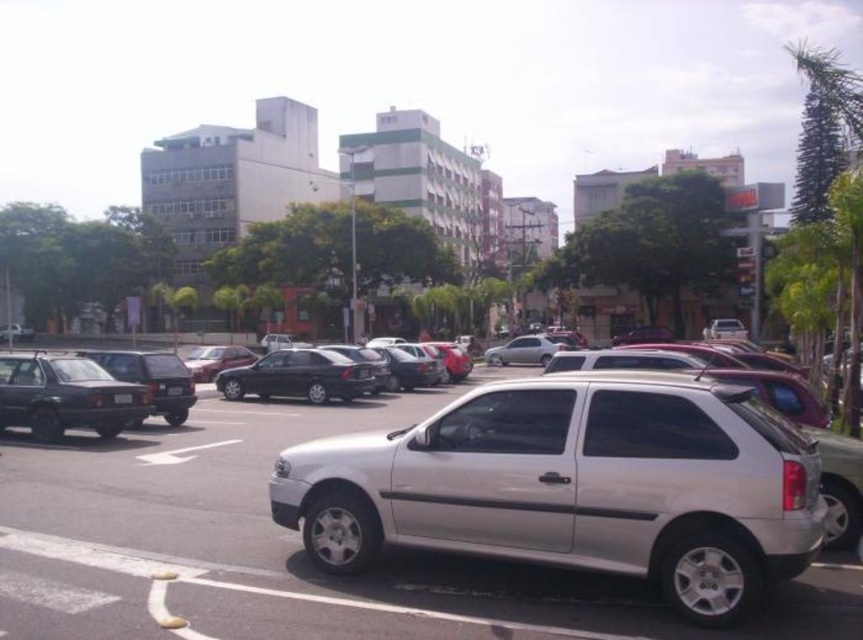
Is satin black sedan at center to the left of satin silver sedan at center from the viewer's perspective?

Yes, satin black sedan at center is to the left of satin silver sedan at center.

This screenshot has width=863, height=640. Find the location of `satin black sedan at center`. satin black sedan at center is located at coordinates (297, 376).

Is shiny black hatchback at left to the right of white plastic license plate at center from the viewer's perspective?

Incorrect, shiny black hatchback at left is not on the right side of white plastic license plate at center.

The width and height of the screenshot is (863, 640). What do you see at coordinates (150, 378) in the screenshot? I see `shiny black hatchback at left` at bounding box center [150, 378].

The image size is (863, 640). Find the location of `shiny black hatchback at left`. shiny black hatchback at left is located at coordinates (150, 378).

Who is positioned more to the right, silver metallic hatchback at center or satin silver sedan at center?

satin silver sedan at center

Between silver metallic hatchback at center and satin silver sedan at center, which one is positioned lower?

silver metallic hatchback at center is below.

Between point (446, 442) and point (524, 342), which one is positioned in front?

Point (446, 442)

I want to click on silver metallic hatchback at center, so click(x=575, y=484).